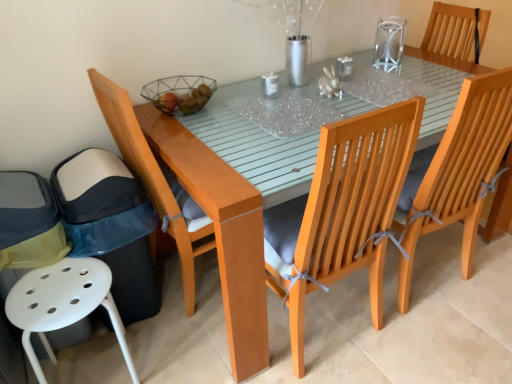
Locate an element on the screen. empty space that is ontop of glossy wood table at center (from a real-world perspective) is located at coordinates (333, 82).